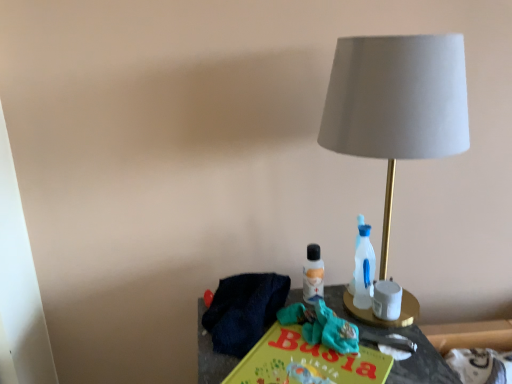
What are the coordinates of `free location above matte black book at center (from a real-world perspective)` in the screenshot? It's located at (304, 326).